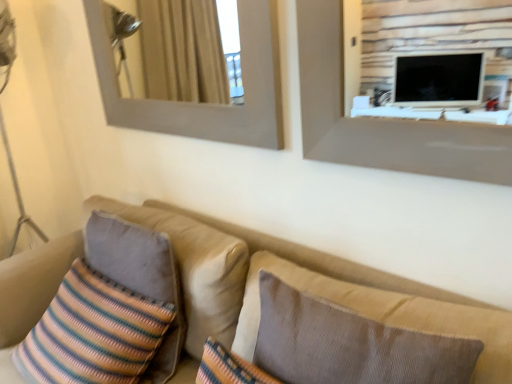
What do you see at coordinates (349, 345) in the screenshot? The width and height of the screenshot is (512, 384). I see `brown textured pillow at center, which is counted as the 1th pillow, starting from the right` at bounding box center [349, 345].

Measure the distance between point (137,344) and camera.

The depth of point (137,344) is 3.71 feet.

In order to click on beige fabric couch at lower left in this screenshot , I will do `click(254, 303)`.

Between beige fabric couch at lower left and striped fabric pillow at lower left, which one has larger size?

Bigger between the two is beige fabric couch at lower left.

Does beige fabric couch at lower left have a greater width compared to striped fabric pillow at lower left?

Yes.

Is point (52, 293) farther from viewer compared to point (96, 276)?

Yes, point (52, 293) is behind point (96, 276).

Is beige fabric couch at lower left to the left of striped fabric pillow at lower left from the viewer's perspective?

No, beige fabric couch at lower left is not to the left of striped fabric pillow at lower left.

Considering the sizes of objects wooden frame at upper left and brown textured pillow at center, which is counted as the 1th pillow, starting from the right, in the image provided, who is wider, wooden frame at upper left or brown textured pillow at center, which is counted as the 1th pillow, starting from the right,?

Wider between the two is brown textured pillow at center, which is counted as the 1th pillow, starting from the right.

Which object is positioned more to the right, wooden frame at upper left or brown textured pillow at center, which is counted as the 1th pillow, starting from the right?

brown textured pillow at center, which is counted as the 1th pillow, starting from the right.

How different are the orientations of wooden frame at upper left and brown textured pillow at center, the second pillow when ordered from left to right, in degrees?

They differ by 0.119 degrees in their facing directions.

In the image, is brown textured pillow at center, arranged as the first pillow when viewed from the front, positioned in front of or behind striped fabric pillow at lower left?

Visually, brown textured pillow at center, arranged as the first pillow when viewed from the front, is located in front of striped fabric pillow at lower left.

Could you tell me if brown textured pillow at center, which is counted as the 1th pillow, starting from the right, is turned towards striped fabric pillow at lower left?

No, brown textured pillow at center, which is counted as the 1th pillow, starting from the right, is not facing towards striped fabric pillow at lower left.

Is brown textured pillow at center, which appears as the second pillow when viewed from the back, positioned far away from striped fabric pillow at lower left?

brown textured pillow at center, which appears as the second pillow when viewed from the back, is actually quite close to striped fabric pillow at lower left.

Between point (154, 251) and point (152, 304), which one is positioned in front?

The point (154, 251) is closer to the camera.

Does striped fabric pillow at left, placed as the second pillow when sorted from right to left, appear on the left side of striped fabric pillow at lower left?

In fact, striped fabric pillow at left, placed as the second pillow when sorted from right to left, is to the right of striped fabric pillow at lower left.

Is striped fabric pillow at left, placed as the second pillow when sorted from front to back, located outside striped fabric pillow at lower left?

No, striped fabric pillow at left, placed as the second pillow when sorted from front to back, is not outside of striped fabric pillow at lower left.

Can you tell me how much striped fabric pillow at left, placed as the second pillow when sorted from front to back, and striped fabric pillow at lower left differ in facing direction?

There is a 0.000476-degree angle between the facing directions of striped fabric pillow at left, placed as the second pillow when sorted from front to back, and striped fabric pillow at lower left.

Is striped fabric pillow at left, placed as the second pillow when sorted from front to back, surrounding brown textured pillow at center, which appears as the second pillow when viewed from the back?

Actually, brown textured pillow at center, which appears as the second pillow when viewed from the back, is outside striped fabric pillow at left, placed as the second pillow when sorted from front to back.

Is striped fabric pillow at left, positioned as the 1th pillow in back-to-front order, oriented away from brown textured pillow at center, which is counted as the 1th pillow, starting from the right?

That's not correct — striped fabric pillow at left, positioned as the 1th pillow in back-to-front order, is not looking away from brown textured pillow at center, which is counted as the 1th pillow, starting from the right.

Find the location of a particular element. pillow below the brown textured pillow at center, which is counted as the 1th pillow, starting from the right (from a real-world perspective) is located at coordinates (140, 277).

Is striped fabric pillow at lower left smaller than striped fabric pillow at left, which is the 1th pillow in left-to-right order?

Incorrect, striped fabric pillow at lower left is not smaller in size than striped fabric pillow at left, which is the 1th pillow in left-to-right order.

From the image's perspective, is striped fabric pillow at lower left under striped fabric pillow at left, positioned as the 1th pillow in back-to-front order?

Correct, striped fabric pillow at lower left appears lower than striped fabric pillow at left, positioned as the 1th pillow in back-to-front order, in the image.

Which point is more distant from viewer, (125, 300) or (126, 234)?

The point (126, 234) is behind.

Is striped fabric pillow at lower left far away from striped fabric pillow at left, positioned as the 1th pillow in back-to-front order?

Actually, striped fabric pillow at lower left and striped fabric pillow at left, positioned as the 1th pillow in back-to-front order, are a little close together.

The width and height of the screenshot is (512, 384). In order to click on throw pillow above the beige fabric couch at lower left (from a real-world perspective) in this screenshot , I will do `click(94, 332)`.

From a real-world perspective, is striped fabric pillow at lower left physically above beige fabric couch at lower left?

Yes.

Between striped fabric pillow at lower left and beige fabric couch at lower left, which one has smaller size?

striped fabric pillow at lower left.

Is beige fabric couch at lower left surrounded by striped fabric pillow at lower left?

No, beige fabric couch at lower left is not inside striped fabric pillow at lower left.

This screenshot has height=384, width=512. Identify the location of studio couch below the striped fabric pillow at lower left (from the image's perspective). (254, 303).

You are a GUI agent. You are given a task and a screenshot of the screen. Output one action in this format:
    pyautogui.click(x=<x>, y=<y>)
    Task: Click on the picture frame behind the brown textured pillow at center, the second pillow when ordered from left to right
    The height and width of the screenshot is (384, 512).
    Given the screenshot: What is the action you would take?
    pyautogui.click(x=205, y=105)

When comparing their distances from wooden frame at upper left, does striped fabric pillow at lower left or striped fabric pillow at left, which is the 1th pillow in left-to-right order, seem further?

striped fabric pillow at lower left.

Estimate the real-world distances between objects in this image. Which object is further from striped fabric pillow at lower left, wooden frame at upper left or striped fabric pillow at left, which is the 1th pillow in left-to-right order?

wooden frame at upper left is positioned further to the anchor striped fabric pillow at lower left.

Which object lies further to the anchor point brown textured pillow at center, arranged as the first pillow when viewed from the front, beige fabric couch at lower left or wooden frame at upper left?

Among the two, wooden frame at upper left is located further to brown textured pillow at center, arranged as the first pillow when viewed from the front.

From the image, which object appears to be farther from brown textured pillow at center, which appears as the second pillow when viewed from the back, wooden frame at upper left or striped fabric pillow at left, which is the 1th pillow in left-to-right order?

Based on the image, wooden frame at upper left appears to be further to brown textured pillow at center, which appears as the second pillow when viewed from the back.

Looking at the image, which one is located further to striped fabric pillow at left, positioned as the 1th pillow in back-to-front order, wooden frame at upper left or brown textured pillow at center, which is counted as the 1th pillow, starting from the right?

wooden frame at upper left lies further to striped fabric pillow at left, positioned as the 1th pillow in back-to-front order, than the other object.

Estimate the real-world distances between objects in this image. Which object is further from striped fabric pillow at left, placed as the second pillow when sorted from front to back, brown textured pillow at center, which appears as the second pillow when viewed from the back, or wooden frame at upper left?

Among the two, wooden frame at upper left is located further to striped fabric pillow at left, placed as the second pillow when sorted from front to back.

Looking at the image, which one is located closer to striped fabric pillow at left, placed as the second pillow when sorted from right to left, brown textured pillow at center, arranged as the first pillow when viewed from the front, or striped fabric pillow at lower left?

striped fabric pillow at lower left.

From the picture: When comparing their distances from wooden frame at upper left, does striped fabric pillow at left, which is the 1th pillow in left-to-right order, or beige fabric couch at lower left seem further?

Among the two, striped fabric pillow at left, which is the 1th pillow in left-to-right order, is located further to wooden frame at upper left.

The image size is (512, 384). Identify the location of throw pillow between beige fabric couch at lower left and striped fabric pillow at left, placed as the second pillow when sorted from right to left, from front to back. (94, 332).

What are the coordinates of `pillow between wooden frame at upper left and brown textured pillow at center, which appears as the second pillow when viewed from the back, in the vertical direction` in the screenshot? It's located at (140, 277).

This screenshot has height=384, width=512. Find the location of `throw pillow that lies between wooden frame at upper left and beige fabric couch at lower left from top to bottom`. throw pillow that lies between wooden frame at upper left and beige fabric couch at lower left from top to bottom is located at coordinates (94, 332).

Find the location of a particular element. pillow between beige fabric couch at lower left and striped fabric pillow at left, placed as the second pillow when sorted from front to back, in the front-back direction is located at coordinates (349, 345).